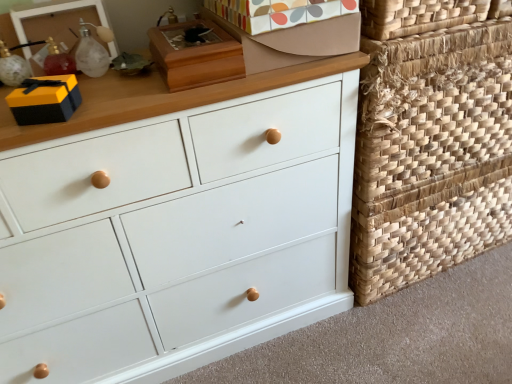
Question: Does point (89, 39) appear closer or farther from the camera than point (371, 273)?

Choices:
 (A) closer
 (B) farther

Answer: (A)

Question: In terms of width, does translucent glass bottle at upper left look wider or thinner when compared to natural woven basket at right, which is the first basket in bottom-to-top order?

Choices:
 (A) thin
 (B) wide

Answer: (A)

Question: Estimate the real-world distances between objects in this image. Which object is farther from the white matte chest of drawers at center?

Choices:
 (A) translucent glass bottle at upper left
 (B) patterned cardboard shoe box at upper center, which is the first shoe box from right to left
 (C) matte black gift box at upper left
 (D) wooden shoe box at upper center, acting as the 2th shoe box starting from the right
 (E) natural woven basket at right, the 2th basket when ordered from top to bottom

Answer: (A)

Question: Which is nearer to the natural woven basket at right, the 2th basket when ordered from top to bottom?

Choices:
 (A) white matte chest of drawers at center
 (B) natural woven basket at right, positioned as the 1th basket in top-to-bottom order
 (C) wooden shoe box at upper center, placed as the 1th shoe box when sorted from left to right
 (D) matte black gift box at upper left
 (E) translucent glass bottle at upper left

Answer: (B)